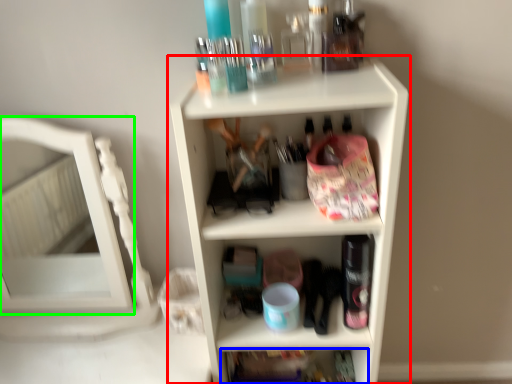
Question: Estimate the real-world distances between objects in this image. Which object is closer to shelf (highlighted by a red box), shelf (highlighted by a blue box) or mirror (highlighted by a green box)?

Choices:
 (A) shelf
 (B) mirror

Answer: (A)